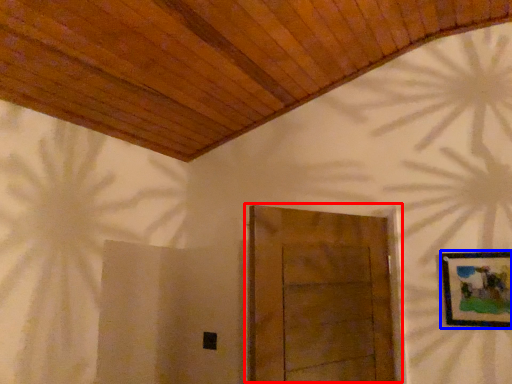
Question: Which object is closer to the camera taking this photo, door (highlighted by a red box) or picture frame (highlighted by a blue box)?

Choices:
 (A) door
 (B) picture frame

Answer: (A)